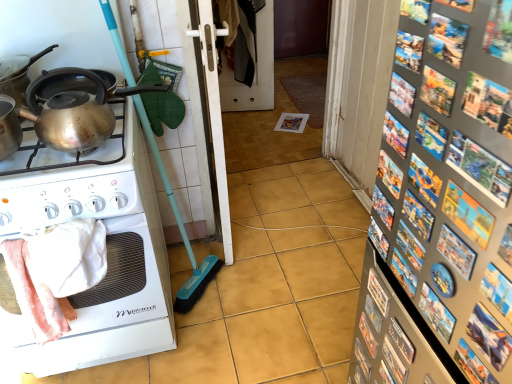
The image size is (512, 384). What do you see at coordinates (108, 233) in the screenshot? I see `white glossy stove at left` at bounding box center [108, 233].

I want to click on white plastic screen door at center, positioned as the second screen door in back-to-front order, so click(x=207, y=115).

The image size is (512, 384). What do you see at coordinates (207, 115) in the screenshot?
I see `white plastic screen door at center, placed as the 1th screen door when sorted from front to back` at bounding box center [207, 115].

At what (x,y) coordinates should I click in order to perform the action: click on white plastic screen door at center, the 2th screen door positioned from the front. Please return your answer as a coordinate pair (x, y). This screenshot has height=384, width=512. Looking at the image, I should click on (248, 56).

What do you see at coordinates (248, 56) in the screenshot?
I see `white plastic screen door at center, the 2th screen door positioned from the front` at bounding box center [248, 56].

Image resolution: width=512 pixels, height=384 pixels. What do you see at coordinates (18, 74) in the screenshot? I see `shiny metallic kettle at upper left` at bounding box center [18, 74].

The height and width of the screenshot is (384, 512). I want to click on shiny metallic kettle at upper left, so click(x=18, y=74).

Describe the element at coordinates (76, 107) in the screenshot. This screenshot has width=512, height=384. I see `shiny metallic kettle at upper left` at that location.

This screenshot has height=384, width=512. What do you see at coordinates (442, 204) in the screenshot?
I see `metallic silver magnets at right` at bounding box center [442, 204].

What are the coordinates of `white glossy stove at left` in the screenshot? It's located at (108, 233).

Does shiny metallic kettle at upper left have a greater height compared to white glossy stove at left?

No, shiny metallic kettle at upper left is not taller than white glossy stove at left.

Is shiny metallic kettle at upper left wider or thinner than white glossy stove at left?

In the image, shiny metallic kettle at upper left appears to be more narrow than white glossy stove at left.

Is shiny metallic kettle at upper left oriented away from white glossy stove at left?

No, white glossy stove at left is not at the back of shiny metallic kettle at upper left.

Consider the image. Considering the relative sizes of shiny metallic kettle at upper left and metallic silver magnets at right in the image provided, is shiny metallic kettle at upper left taller than metallic silver magnets at right?

No, shiny metallic kettle at upper left is not taller than metallic silver magnets at right.

From the image's perspective, which one is positioned lower, shiny metallic kettle at upper left or metallic silver magnets at right?

metallic silver magnets at right, from the image's perspective.

Locate an element on the screen. This screenshot has height=384, width=512. bulletin board that appears below the shiny metallic kettle at upper left (from the image's perspective) is located at coordinates (442, 204).

Which object is thinner, shiny metallic kettle at upper left or metallic silver magnets at right?

shiny metallic kettle at upper left is thinner.

Based on the photo, from the image's perspective, is white glossy stove at left beneath white plastic screen door at center, placed as the 1th screen door when sorted from front to back?

Yes, from the image's perspective, white glossy stove at left is below white plastic screen door at center, placed as the 1th screen door when sorted from front to back.

From the picture: Considering the sizes of objects white glossy stove at left and white plastic screen door at center, positioned as the second screen door in back-to-front order, in the image provided, who is bigger, white glossy stove at left or white plastic screen door at center, positioned as the second screen door in back-to-front order,?

With larger size is white glossy stove at left.

Is white glossy stove at left not close to white plastic screen door at center, positioned as the second screen door in back-to-front order?

Actually, white glossy stove at left and white plastic screen door at center, positioned as the second screen door in back-to-front order, are a little close together.

Is shiny metallic kettle at upper left facing away from shiny metallic kettle at upper left?

No.

Which object is further away from the camera, shiny metallic kettle at upper left or shiny metallic kettle at upper left?

shiny metallic kettle at upper left is further from the camera.

Which is less distant, [42,50] or [95,110]?

The point [95,110] is in front.

Is shiny metallic kettle at left positioned behind metallic silver magnets at right?

Yes, shiny metallic kettle at left is further from the viewer.

Which is more to the right, shiny metallic kettle at left or metallic silver magnets at right?

metallic silver magnets at right.

From a real-world perspective, is shiny metallic kettle at left under metallic silver magnets at right?

No.

Considering the relative sizes of shiny metallic kettle at left and metallic silver magnets at right in the image provided, is shiny metallic kettle at left wider than metallic silver magnets at right?

Yes, shiny metallic kettle at left is wider than metallic silver magnets at right.

Is shiny metallic kettle at upper left taller or shorter than white glossy stove at left?

Considering their sizes, shiny metallic kettle at upper left has less height than white glossy stove at left.

How much distance is there between shiny metallic kettle at upper left and white glossy stove at left?

shiny metallic kettle at upper left is 15.92 inches from white glossy stove at left.

From a real-world perspective, is shiny metallic kettle at upper left positioned under white glossy stove at left based on gravity?

No, from a real-world perspective, shiny metallic kettle at upper left is not beneath white glossy stove at left.

Relative to white glossy stove at left, is shiny metallic kettle at upper left in front or behind?

Visually, shiny metallic kettle at upper left is located behind white glossy stove at left.

What's the angular difference between white glossy stove at left and white plastic screen door at center, the 2th screen door positioned from the front,'s facing directions?

8.76 degrees separate the facing orientations of white glossy stove at left and white plastic screen door at center, the 2th screen door positioned from the front.

Who is shorter, white glossy stove at left or white plastic screen door at center, positioned as the 1th screen door in back-to-front order?

white glossy stove at left is shorter.

Is point (11, 316) closer or farther from the camera than point (256, 54)?

Point (11, 316) is positioned closer to the camera compared to point (256, 54).

Which object is positioned more to the right, white glossy stove at left or white plastic screen door at center, the 2th screen door positioned from the front?

white plastic screen door at center, the 2th screen door positioned from the front.

Find the location of a particular element. The width and height of the screenshot is (512, 384). kettle lying on the right of white glossy stove at left is located at coordinates (76, 107).

Image resolution: width=512 pixels, height=384 pixels. What are the coordinates of `kettle located on the left of metallic silver magnets at right` in the screenshot? It's located at (76, 107).

Considering their positions, is shiny metallic kettle at upper left positioned closer to shiny metallic kettle at upper left than white glossy stove at left?

shiny metallic kettle at upper left.

Estimate the real-world distances between objects in this image. Which object is further from shiny metallic kettle at upper left, shiny metallic kettle at left or white plastic screen door at center, the 2th screen door positioned from the front?

white plastic screen door at center, the 2th screen door positioned from the front, is further to shiny metallic kettle at upper left.

From the image, which object appears to be farther from metallic silver magnets at right, shiny metallic kettle at upper left or shiny metallic kettle at upper left?

shiny metallic kettle at upper left is further to metallic silver magnets at right.

Which object lies nearer to the anchor point white glossy stove at left, shiny metallic kettle at upper left or metallic silver magnets at right?

shiny metallic kettle at upper left is closer to white glossy stove at left.

Considering their positions, is shiny metallic kettle at left positioned closer to white glossy stove at left than white plastic screen door at center, the 2th screen door positioned from the front?

The object closer to white glossy stove at left is shiny metallic kettle at left.

When comparing their distances from shiny metallic kettle at upper left, does metallic silver magnets at right or shiny metallic kettle at upper left seem closer?

Among the two, shiny metallic kettle at upper left is located nearer to shiny metallic kettle at upper left.

Looking at the image, which one is located closer to white plastic screen door at center, positioned as the 1th screen door in back-to-front order, metallic silver magnets at right or white glossy stove at left?

white glossy stove at left is positioned closer to the anchor white plastic screen door at center, positioned as the 1th screen door in back-to-front order.

When comparing their distances from white plastic screen door at center, positioned as the second screen door in back-to-front order, does shiny metallic kettle at left or metallic silver magnets at right seem closer?

shiny metallic kettle at left lies closer to white plastic screen door at center, positioned as the second screen door in back-to-front order, than the other object.

Locate an element on the screen. The height and width of the screenshot is (384, 512). home appliance between shiny metallic kettle at left and white plastic screen door at center, the 2th screen door positioned from the front, along the z-axis is located at coordinates (108, 233).

Where is `screen door between shiny metallic kettle at upper left and white plastic screen door at center, the 2th screen door positioned from the front, along the z-axis`? The height and width of the screenshot is (384, 512). screen door between shiny metallic kettle at upper left and white plastic screen door at center, the 2th screen door positioned from the front, along the z-axis is located at coordinates point(207,115).

Locate an element on the screen. The image size is (512, 384). screen door between white glossy stove at left and white plastic screen door at center, positioned as the 1th screen door in back-to-front order, from front to back is located at coordinates (207, 115).

The width and height of the screenshot is (512, 384). Identify the location of gas stove between shiny metallic kettle at upper left and shiny metallic kettle at upper left. (69, 179).